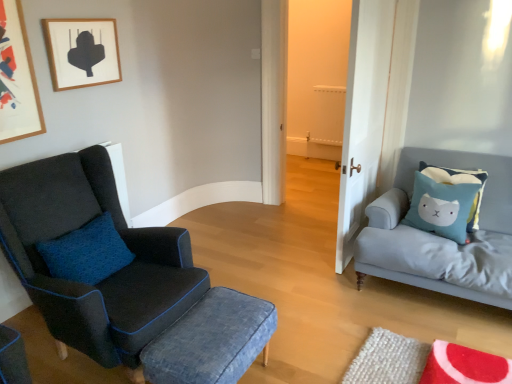
Question: Is wooden picture frame at upper left, the second picture frame positioned from the left, located outside white wood door at center?

Choices:
 (A) no
 (B) yes

Answer: (B)

Question: Is the depth of wooden picture frame at upper left, the second picture frame positioned from the left, greater than that of white wood door at center?

Choices:
 (A) no
 (B) yes

Answer: (B)

Question: Is wooden picture frame at upper left, the second picture frame positioned from the left, shorter than white wood door at center?

Choices:
 (A) no
 (B) yes

Answer: (B)

Question: Does wooden picture frame at upper left, the second picture frame positioned from the left, have a smaller size compared to white wood door at center?

Choices:
 (A) no
 (B) yes

Answer: (B)

Question: Is wooden picture frame at upper left, the second picture frame positioned from the left, turned away from white wood door at center?

Choices:
 (A) no
 (B) yes

Answer: (A)

Question: Based on their sizes in the image, would you say wooden picture frame at upper left, the first picture frame when ordered from right to left, is bigger or smaller than denim fabric stool at center?

Choices:
 (A) small
 (B) big

Answer: (A)

Question: Is wooden picture frame at upper left, the first picture frame when ordered from right to left, to the left or to the right of denim fabric stool at center in the image?

Choices:
 (A) left
 (B) right

Answer: (A)

Question: In terms of width, does wooden picture frame at upper left, the second picture frame positioned from the left, look wider or thinner when compared to denim fabric stool at center?

Choices:
 (A) wide
 (B) thin

Answer: (B)

Question: Relative to denim fabric stool at center, is wooden picture frame at upper left, the first picture frame when ordered from right to left, in front or behind?

Choices:
 (A) behind
 (B) front

Answer: (A)

Question: Is wooden framed artwork at upper left, arranged as the 2th picture frame when viewed from the right, inside the boundaries of wooden picture frame at upper left, the first picture frame when ordered from right to left, or outside?

Choices:
 (A) inside
 (B) outside

Answer: (B)

Question: In terms of width, does wooden framed artwork at upper left, arranged as the 2th picture frame when viewed from the right, look wider or thinner when compared to wooden picture frame at upper left, the second picture frame positioned from the left?

Choices:
 (A) wide
 (B) thin

Answer: (B)

Question: Based on their sizes in the image, would you say wooden framed artwork at upper left, which is counted as the 1th picture frame, starting from the left, is bigger or smaller than wooden picture frame at upper left, the second picture frame positioned from the left?

Choices:
 (A) small
 (B) big

Answer: (A)

Question: Is point (0, 89) positioned closer to the camera than point (104, 21)?

Choices:
 (A) farther
 (B) closer

Answer: (B)

Question: In terms of width, does wooden framed artwork at upper left, arranged as the 2th picture frame when viewed from the right, look wider or thinner when compared to light blue fabric cushion at right?

Choices:
 (A) thin
 (B) wide

Answer: (A)

Question: Based on their positions, is wooden framed artwork at upper left, which is counted as the 1th picture frame, starting from the left, located to the left or right of light blue fabric cushion at right?

Choices:
 (A) left
 (B) right

Answer: (A)